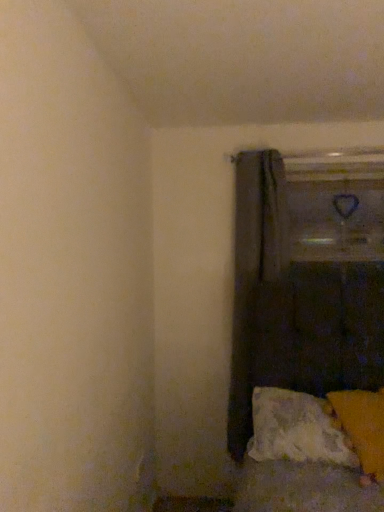
Question: Is point (382, 464) positioned closer to the camera than point (264, 216)?

Choices:
 (A) closer
 (B) farther

Answer: (A)

Question: Considering the relative positions of orange fabric pillow at lower right, acting as the 2th pillow starting from the left, and dark gray fabric curtain at center in the image provided, is orange fabric pillow at lower right, acting as the 2th pillow starting from the left, to the left or to the right of dark gray fabric curtain at center?

Choices:
 (A) right
 (B) left

Answer: (A)

Question: Which is farther from the orange fabric pillow at lower right, which appears as the first pillow when viewed from the right?

Choices:
 (A) textured white pillow at lower right, which ranks as the second pillow in right-to-left order
 (B) dark gray fabric curtain at center

Answer: (B)

Question: Considering the real-world distances, which object is closest to the dark gray fabric curtain at center?

Choices:
 (A) textured white pillow at lower right, which ranks as the second pillow in right-to-left order
 (B) orange fabric pillow at lower right, which appears as the first pillow when viewed from the right

Answer: (A)